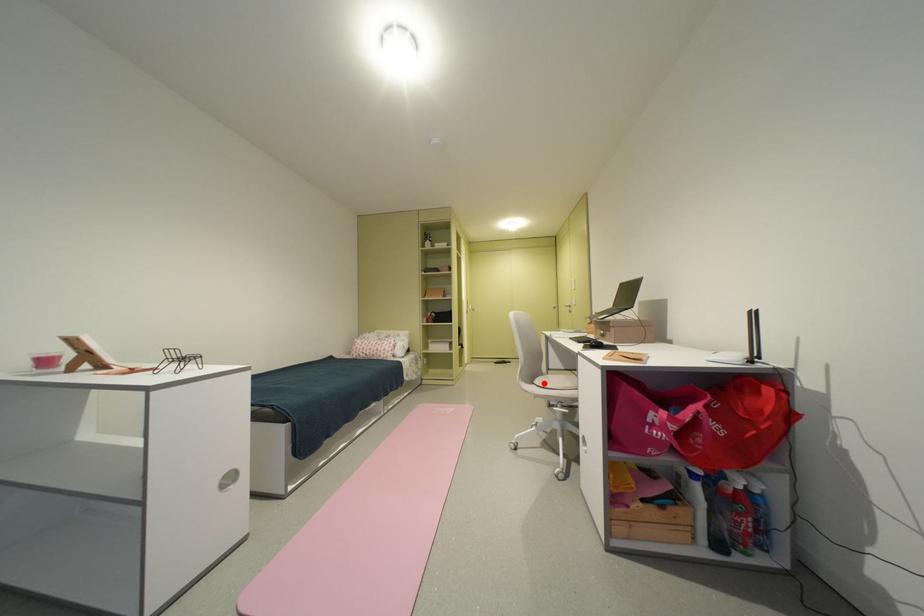
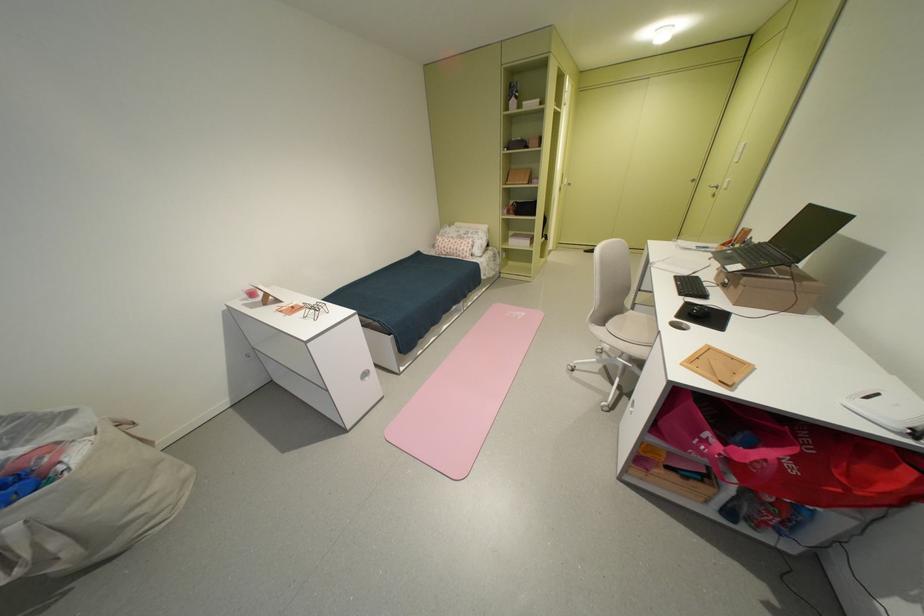
Question: A red point is marked in image1. In image2, is the corresponding 3D point closer to the camera or farther? Reply with the corresponding letter.

Choices:
 (A) The corresponding 3D point is closer.
 (B) The corresponding 3D point is farther.

Answer: (A)